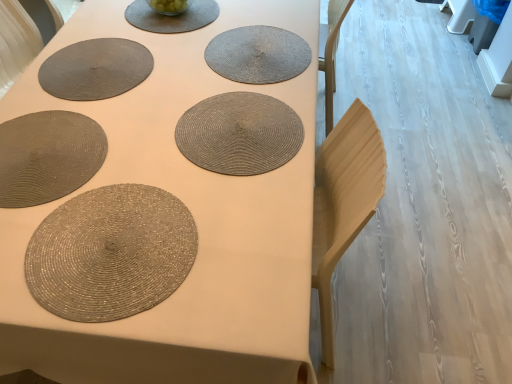
You are a GUI agent. You are given a task and a screenshot of the screen. Output one action in this format:
    pyautogui.click(x=<x>, y=<y>)
    Task: Click on the vacant space in rattan placemat at lower left, acting as the 2th paper plate starting from the back (from a real-world perspective)
    The width and height of the screenshot is (512, 384).
    Given the screenshot: What is the action you would take?
    pyautogui.click(x=45, y=149)